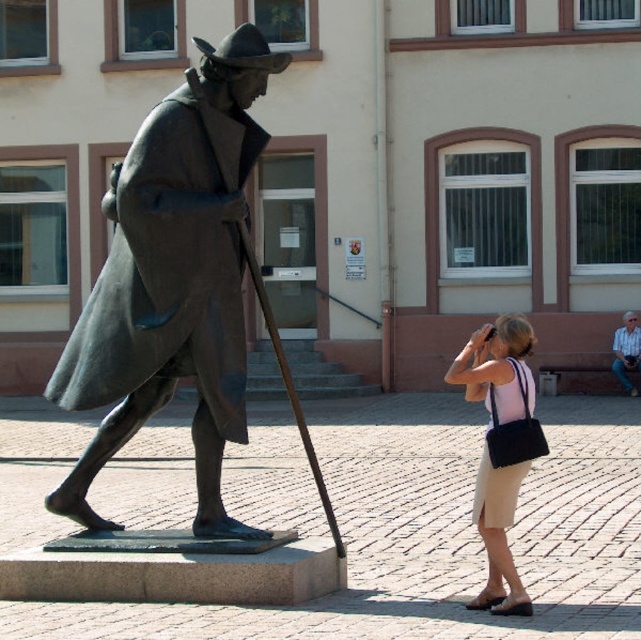
You are a photographer trying to capture the bronze statue at left and the beige fabric skirt at lower right in the same frame. Based on their positions, can you determine which object is closer to the camera?

The beige fabric skirt at lower right is closer to the camera because it is positioned to the right of the bronze statue at left, which is further away.

You are standing at point (126, 321) and want to take a photo of the bronze statue of a man walking. The statue is 9.37 meters away from you. If your camera has a maximum focus range of 10 meters, will you be able to take a clear photo?

Yes, you can take a clear photo because the statue is 9.37 meters away, which is within the camera maximum focus range of 10 meters.

You are a photographer trying to capture both the beige fabric skirt at lower right and the light blue shirt at right in the same frame. Which clothing item should you focus on first to ensure both are in the frame?

The beige fabric skirt at lower right is not as tall as the light blue shirt at right. To include both in the frame, focus on the light blue shirt at right first since it is taller and adjust the camera angle to include the shorter beige fabric skirt at lower right.